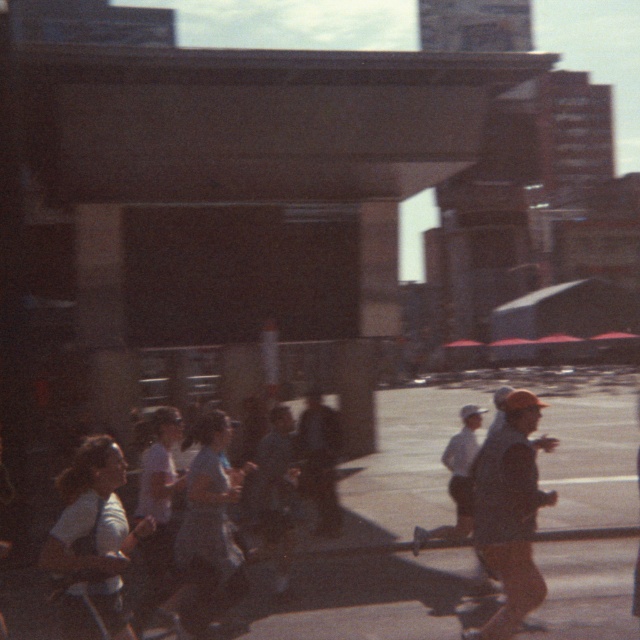
Looking at this image, you are a runner participating in a marathon and you see the smooth asphalt road at center and the orange cap at right. Which object is farther away from you?

The orange cap at right is farther away from you because it is positioned behind the smooth asphalt road at center.